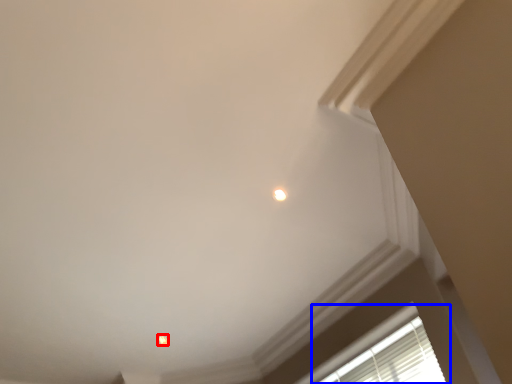
Question: Among these objects, which one is nearest to the camera, dot (highlighted by a red box) or window (highlighted by a blue box)?

Choices:
 (A) dot
 (B) window

Answer: (B)